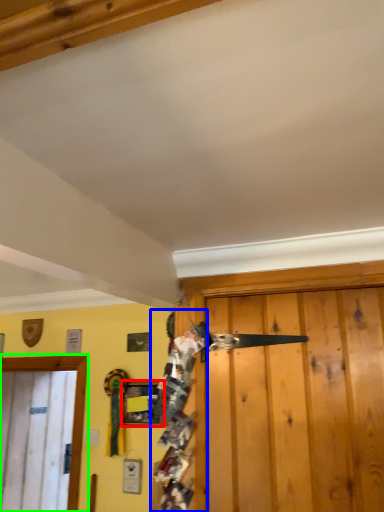
Question: Which object is the farthest from picture frame (highlighted by a red box)? Choose among these: person (highlighted by a blue box) or door (highlighted by a green box).

Choices:
 (A) person
 (B) door

Answer: (A)